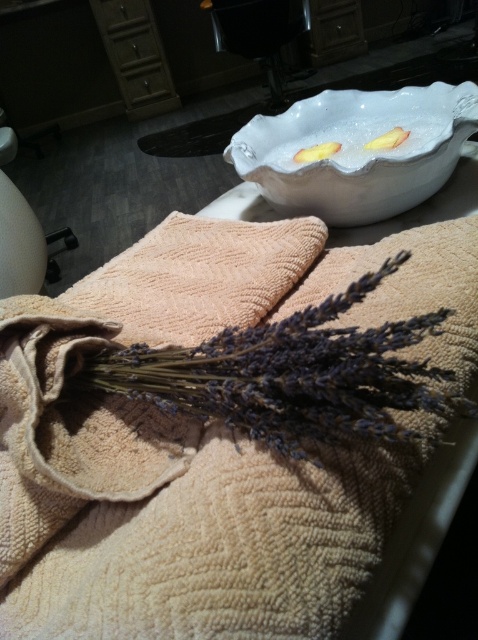
Question: Can you confirm if dry purple lavender at center is bigger than white glossy bowl at upper center?

Choices:
 (A) yes
 (B) no

Answer: (B)

Question: Is dry purple lavender at center bigger than white glossy bowl at upper center?

Choices:
 (A) no
 (B) yes

Answer: (A)

Question: Which point appears farthest from the camera in this image?

Choices:
 (A) (14, 620)
 (B) (350, 157)

Answer: (B)

Question: Which point appears closest to the camera in this image?

Choices:
 (A) (400, 410)
 (B) (281, 180)

Answer: (A)

Question: Which object is farther from the camera taking this photo?

Choices:
 (A) dry purple lavender at center
 (B) white glossy bowl at upper center
 (C) beige textured towel at center

Answer: (B)

Question: Can you confirm if dry purple lavender at center is positioned above white glossy bowl at upper center?

Choices:
 (A) no
 (B) yes

Answer: (A)